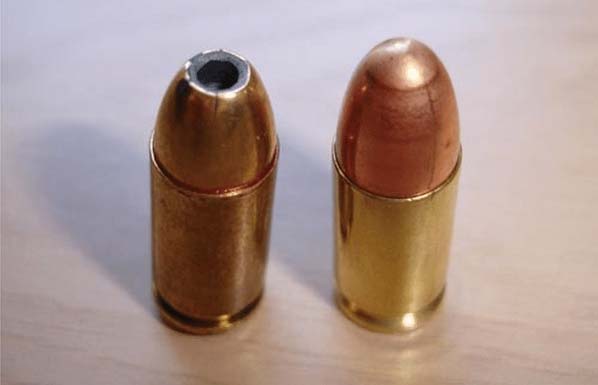
At what (x,y) coordinates should I click in order to perform the action: click on surface. Please return your answer as a coordinate pair (x, y). Image resolution: width=598 pixels, height=385 pixels. Looking at the image, I should click on (545, 360).